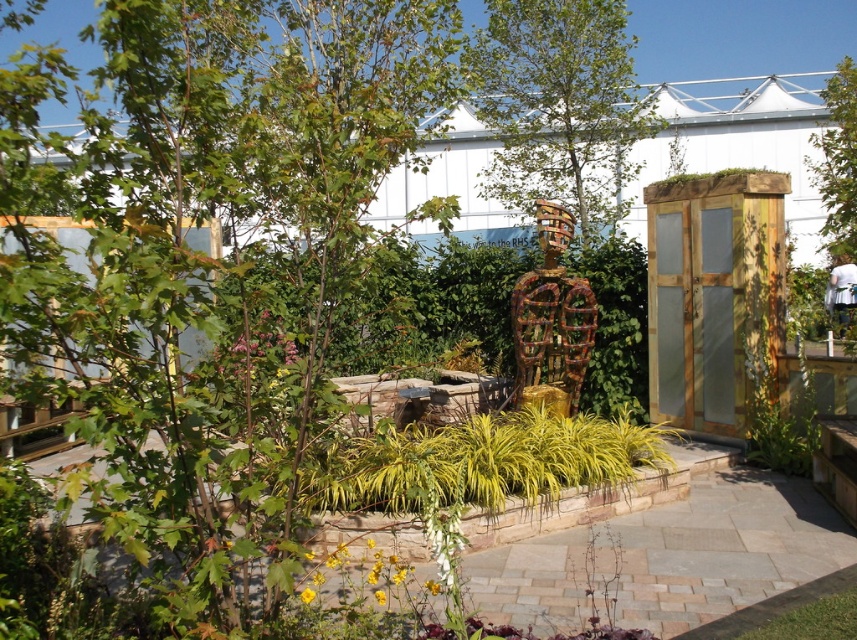
You are standing in the garden and want to locate the point at coordinates (x=559, y=106). Which object in the garden does this point fall on?

The point at coordinates (x=559, y=106) falls on the green leafy tree at upper center.

You are a gardener who needs to water both the green leafy tree at upper center and the green leafy tree at upper right. The watering can you have can only reach 3 meters. Can you water both trees without moving the watering can?

The distance between the green leafy tree at upper center and the green leafy tree at upper right is 3.37 meters, which is greater than the watering can reach of 3 meters. Therefore, you cannot water both trees without moving the watering can.